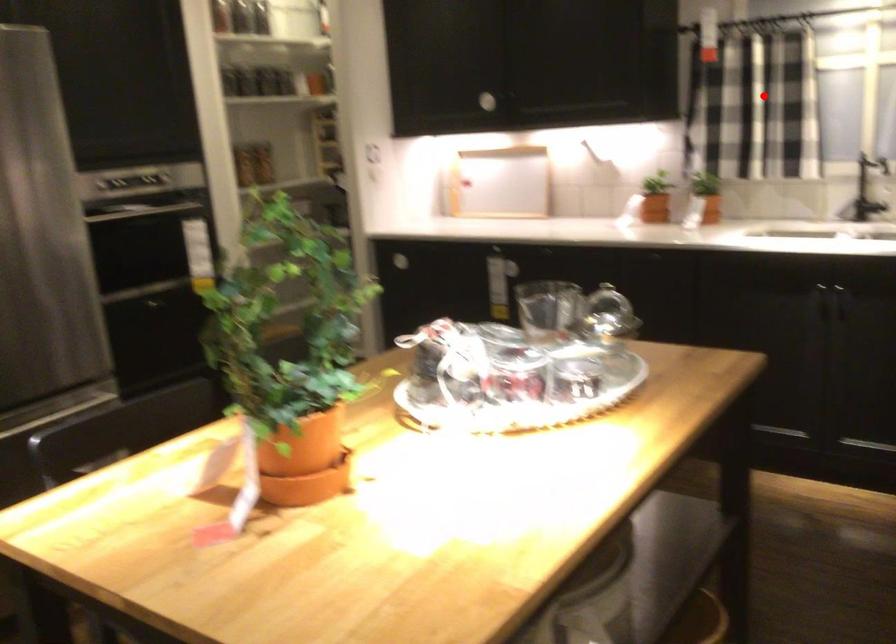
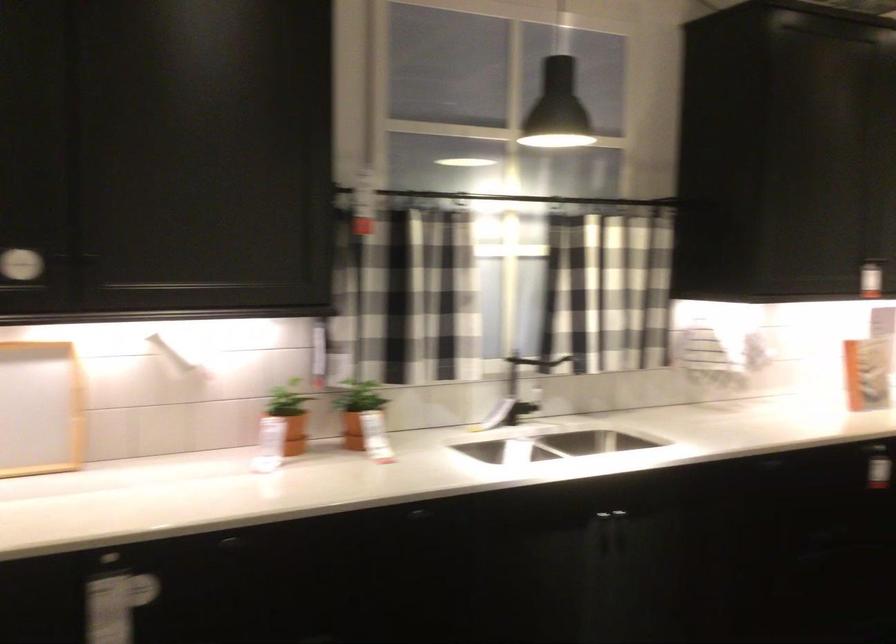
Question: I am providing you with two images of the same scene from different viewpoints. Image1 has a red point marked. In image2, the corresponding 3D location appears at what relative position? Reply with the corresponding letter.

Choices:
 (A) Closer
 (B) Farther

Answer: (A)